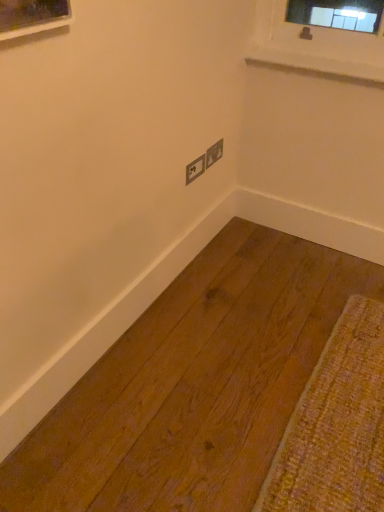
Question: Does matte gray electrical outlet at center, acting as the second electric outlet starting from the left, have a larger size compared to white smooth window sill at upper right?

Choices:
 (A) no
 (B) yes

Answer: (A)

Question: From a real-world perspective, is matte gray electrical outlet at center, the first electric outlet positioned from the right, located higher than white smooth window sill at upper right?

Choices:
 (A) yes
 (B) no

Answer: (B)

Question: Is matte gray electrical outlet at center, the first electric outlet positioned from the right, further to the viewer compared to white smooth window sill at upper right?

Choices:
 (A) yes
 (B) no

Answer: (A)

Question: Is matte gray electrical outlet at center, the first electric outlet positioned from the right, directly adjacent to white smooth window sill at upper right?

Choices:
 (A) yes
 (B) no

Answer: (B)

Question: Can you confirm if matte gray electrical outlet at center, the first electric outlet positioned from the right, is smaller than white smooth window sill at upper right?

Choices:
 (A) no
 (B) yes

Answer: (B)

Question: Is point (347, 65) closer or farther from the camera than point (193, 179)?

Choices:
 (A) closer
 (B) farther

Answer: (A)

Question: Considering their positions, is white smooth window sill at upper right located in front of or behind matte gray electric outlet at center, arranged as the second electric outlet when viewed from the right?

Choices:
 (A) front
 (B) behind

Answer: (A)

Question: In the image, is white smooth window sill at upper right on the left side or the right side of matte gray electric outlet at center, arranged as the second electric outlet when viewed from the right?

Choices:
 (A) right
 (B) left

Answer: (A)

Question: In terms of height, does white smooth window sill at upper right look taller or shorter compared to matte gray electric outlet at center, the 1th electric outlet from the left?

Choices:
 (A) short
 (B) tall

Answer: (A)

Question: From their relative heights in the image, would you say matte gray electrical outlet at center, acting as the second electric outlet starting from the left, is taller or shorter than matte gray electric outlet at center, arranged as the second electric outlet when viewed from the right?

Choices:
 (A) tall
 (B) short

Answer: (A)

Question: Which is correct: matte gray electrical outlet at center, the first electric outlet positioned from the right, is inside matte gray electric outlet at center, arranged as the second electric outlet when viewed from the right, or outside of it?

Choices:
 (A) inside
 (B) outside

Answer: (B)

Question: Relative to matte gray electric outlet at center, the 1th electric outlet from the left, is matte gray electrical outlet at center, acting as the second electric outlet starting from the left, in front or behind?

Choices:
 (A) front
 (B) behind

Answer: (B)

Question: Is matte gray electrical outlet at center, acting as the second electric outlet starting from the left, bigger or smaller than matte gray electric outlet at center, the 1th electric outlet from the left?

Choices:
 (A) small
 (B) big

Answer: (A)

Question: Considering the positions of point click(x=218, y=151) and point click(x=307, y=58), is point click(x=218, y=151) closer or farther from the camera than point click(x=307, y=58)?

Choices:
 (A) closer
 (B) farther

Answer: (B)

Question: Is matte gray electrical outlet at center, the first electric outlet positioned from the right, in front of or behind white smooth window sill at upper right in the image?

Choices:
 (A) front
 (B) behind

Answer: (B)